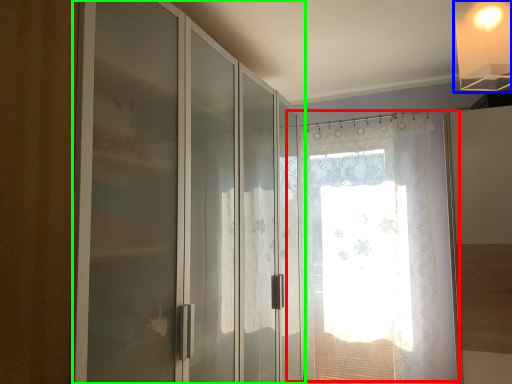
Question: Which object is positioned closest to window (highlighted by a red box)? Select from light fixture (highlighted by a blue box) and door (highlighted by a green box).

Choices:
 (A) light fixture
 (B) door

Answer: (B)